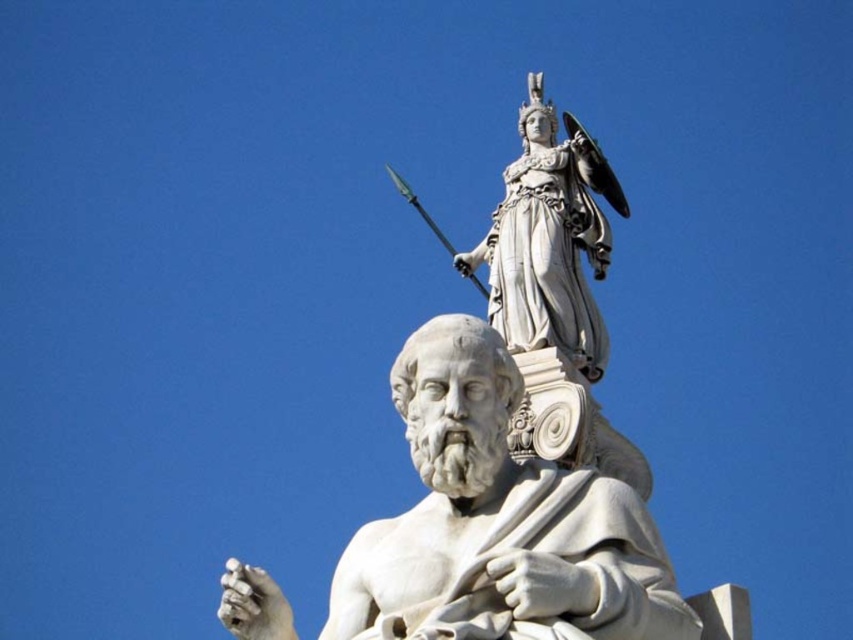
In the scene shown: Is white marble statue at center smaller than white marble statue at upper center?

No, white marble statue at center is not smaller than white marble statue at upper center.

Can you confirm if white marble statue at center is positioned to the left of white marble statue at upper center?

Indeed, white marble statue at center is positioned on the left side of white marble statue at upper center.

Is point (621, 484) closer to viewer compared to point (509, 266)?

Yes.

The image size is (853, 640). I want to click on white marble statue at center, so click(x=497, y=522).